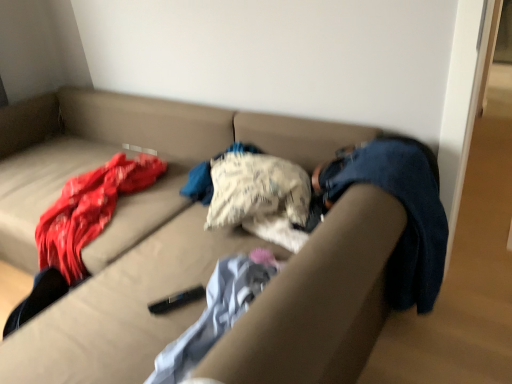
Locate an element on the screen. beige fabric couch at center is located at coordinates (138, 224).

What do you see at coordinates (138, 224) in the screenshot? The width and height of the screenshot is (512, 384). I see `beige fabric couch at center` at bounding box center [138, 224].

What is the approximate width of light blue textured blanket at center?

10.01 inches.

Describe the element at coordinates (216, 313) in the screenshot. I see `light blue textured blanket at center` at that location.

Find the location of `light blue textured blanket at center`. light blue textured blanket at center is located at coordinates (216, 313).

Measure the distance between point (x=200, y=328) and camera.

Point (x=200, y=328) and camera are 3.67 feet apart from each other.

This screenshot has height=384, width=512. What are the coordinates of `beige fabric couch at center` in the screenshot? It's located at (138, 224).

Does beige fabric couch at center appear on the right side of light blue textured blanket at center?

Incorrect, beige fabric couch at center is not on the right side of light blue textured blanket at center.

Is beige fabric couch at center in front of or behind light blue textured blanket at center in the image?

Clearly, beige fabric couch at center is in front of light blue textured blanket at center.

Which is closer to the camera, [323,309] or [239,297]?

Point [323,309].

From the image's perspective, relative to light blue textured blanket at center, is beige fabric couch at center above or below?

beige fabric couch at center is situated higher than light blue textured blanket at center in the image.

From a real-world perspective, is beige fabric couch at center over light blue textured blanket at center?

No, from a real-world perspective, beige fabric couch at center is not above light blue textured blanket at center.

Looking at this image, considering the relative sizes of beige fabric couch at center and light blue textured blanket at center in the image provided, is beige fabric couch at center thinner than light blue textured blanket at center?

No, beige fabric couch at center is not thinner than light blue textured blanket at center.

Is beige fabric couch at center taller or shorter than light blue textured blanket at center?

Considering their sizes, beige fabric couch at center has more height than light blue textured blanket at center.

Based on their sizes in the image, would you say beige fabric couch at center is bigger or smaller than light blue textured blanket at center?

beige fabric couch at center is bigger than light blue textured blanket at center.

Is beige fabric couch at center spatially inside light blue textured blanket at center, or outside of it?

beige fabric couch at center is located beyond the bounds of light blue textured blanket at center.

Is beige fabric couch at center not close to light blue textured blanket at center?

Actually, beige fabric couch at center and light blue textured blanket at center are a little close together.

Is beige fabric couch at center looking in the opposite direction of light blue textured blanket at center?

No, light blue textured blanket at center is not at the back of beige fabric couch at center.

Find the location of a particular element. The image size is (512, 384). studio couch that is in front of the light blue textured blanket at center is located at coordinates (138, 224).

Does light blue textured blanket at center appear on the right side of beige fabric couch at center?

Yes, light blue textured blanket at center is to the right of beige fabric couch at center.

Which is in front, light blue textured blanket at center or beige fabric couch at center?

beige fabric couch at center is closer to the camera.

Which is in front, point (208, 323) or point (205, 142)?

Positioned in front is point (208, 323).

From the image's perspective, is light blue textured blanket at center positioned above or below beige fabric couch at center?

light blue textured blanket at center is situated lower than beige fabric couch at center in the image.

From a real-world perspective, is light blue textured blanket at center on beige fabric couch at center?

Yes.

From the picture: Can you confirm if light blue textured blanket at center is wider than beige fabric couch at center?

No.

Which of these two, light blue textured blanket at center or beige fabric couch at center, stands taller?

beige fabric couch at center is taller.

Who is smaller, light blue textured blanket at center or beige fabric couch at center?

light blue textured blanket at center.

Is beige fabric couch at center completely or partially inside light blue textured blanket at center?

Actually, beige fabric couch at center is outside light blue textured blanket at center.

Is light blue textured blanket at center touching beige fabric couch at center?

No.

Could you tell me if light blue textured blanket at center is facing beige fabric couch at center?

Yes, light blue textured blanket at center is facing beige fabric couch at center.

How far apart are light blue textured blanket at center and beige fabric couch at center?

light blue textured blanket at center is 17.35 inches from beige fabric couch at center.

Image resolution: width=512 pixels, height=384 pixels. In order to click on studio couch located above the light blue textured blanket at center (from the image's perspective) in this screenshot , I will do `click(138, 224)`.

Locate an element on the screen. studio couch located underneath the light blue textured blanket at center (from a real-world perspective) is located at coordinates (138, 224).

This screenshot has width=512, height=384. I want to click on blanket behind the beige fabric couch at center, so click(216, 313).